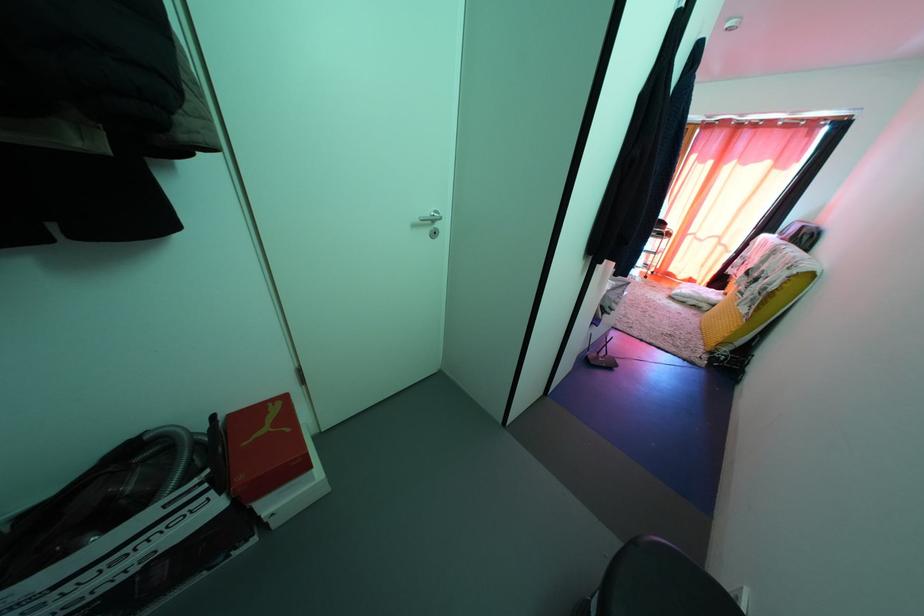
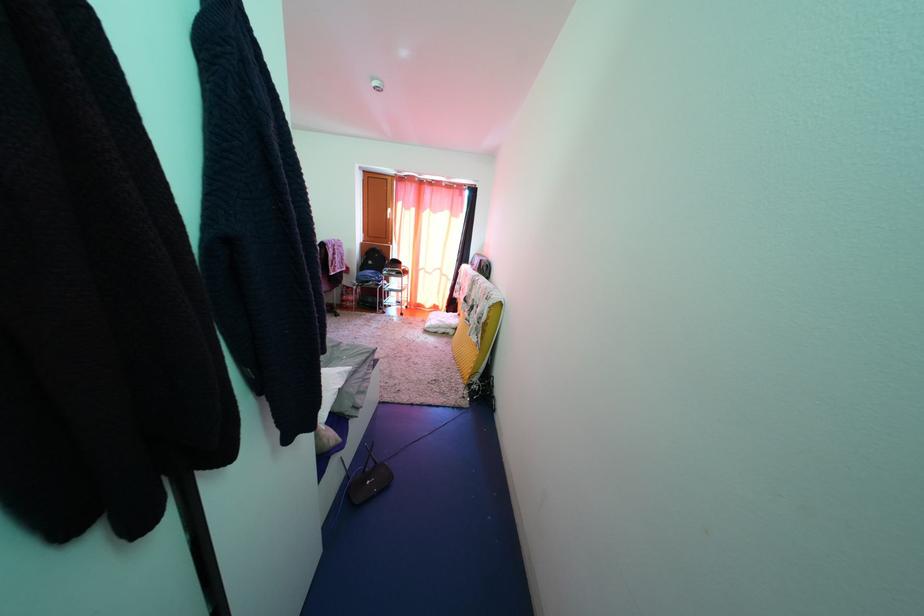
Question: The images are taken continuously from a first-person perspective. In which direction is your viewpoint rotating?

Choices:
 (A) Left
 (B) Right
 (C) Up
 (D) Down

Answer: (B)